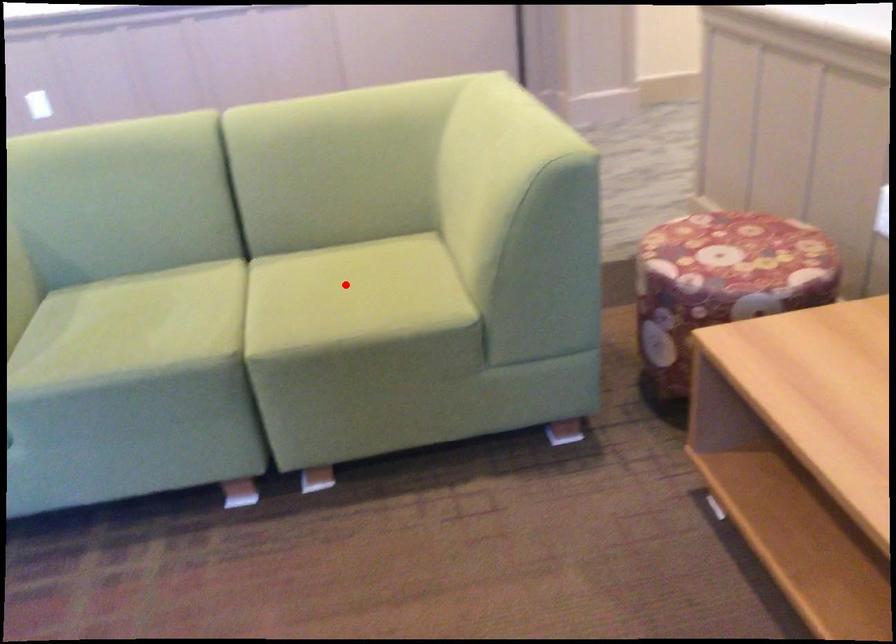
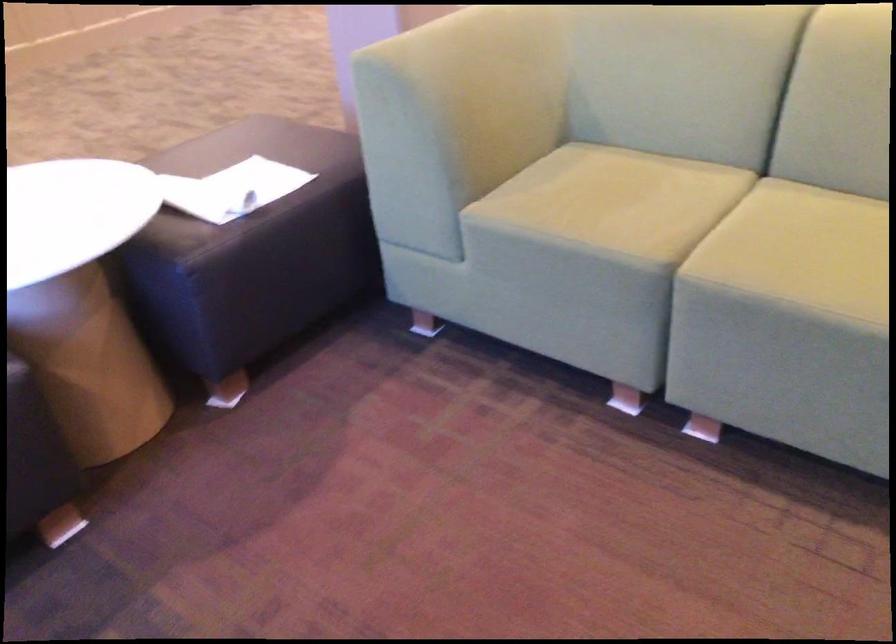
Where in the second image is the point corresponding to the highlighted location from the first image?

(837, 238)